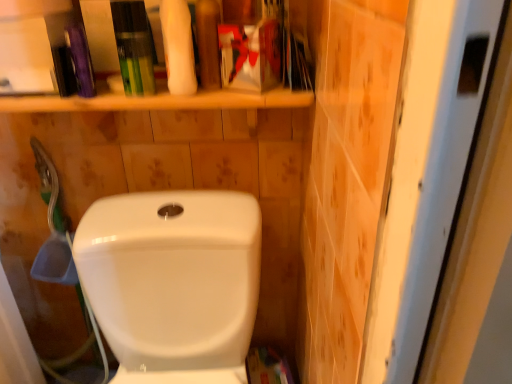
You are a GUI agent. You are given a task and a screenshot of the screen. Output one action in this format:
    pyautogui.click(x=<x>, y=<y>)
    Task: Click on the white glossy toilet at center
    Image resolution: width=512 pixels, height=384 pixels.
    Given the screenshot: What is the action you would take?
    tap(173, 282)

This screenshot has height=384, width=512. Find the location of `matte plastic toothpaste tube at upper center, acting as the 2th toiletry starting from the left`. matte plastic toothpaste tube at upper center, acting as the 2th toiletry starting from the left is located at coordinates (208, 43).

From the picture: Is white matte sponge at upper center to the left or to the right of green plastic tube at upper center, placed as the 2th toiletry when sorted from right to left, in the image?

Based on their positions, white matte sponge at upper center is located to the right of green plastic tube at upper center, placed as the 2th toiletry when sorted from right to left.

From the image's perspective, between white matte sponge at upper center and green plastic tube at upper center, placed as the 2th toiletry when sorted from right to left, which one is located above?

white matte sponge at upper center appears higher in the image.

From the white matte sponge at upper center, count 1st toiletrys backward and point to it. Please provide its 2D coordinates.

[(133, 46)]

Can you confirm if white matte sponge at upper center is shorter than green plastic tube at upper center, placed as the 2th toiletry when sorted from right to left?

No, white matte sponge at upper center is not shorter than green plastic tube at upper center, placed as the 2th toiletry when sorted from right to left.

Is matte plastic toothpaste tube at upper center, arranged as the first toiletry when viewed from the right, inside or outside of white glossy toilet at center?

matte plastic toothpaste tube at upper center, arranged as the first toiletry when viewed from the right, cannot be found inside white glossy toilet at center.

Does matte plastic toothpaste tube at upper center, arranged as the first toiletry when viewed from the right, touch white glossy toilet at center?

No.

This screenshot has width=512, height=384. Identify the location of toilet that appears below the matte plastic toothpaste tube at upper center, arranged as the first toiletry when viewed from the right (from a real-world perspective). (173, 282).

How much distance is there between matte plastic toothpaste tube at upper center, arranged as the first toiletry when viewed from the right, and white glossy toilet at center?

matte plastic toothpaste tube at upper center, arranged as the first toiletry when viewed from the right, and white glossy toilet at center are 15.03 inches apart from each other.

Which of these two, green plastic tube at upper center, placed as the first toiletry when sorted from left to right, or white glossy toilet at center, is bigger?

white glossy toilet at center.

Which is farther, [129,78] or [125,215]?

The point [125,215] is farther from the camera.

Is green plastic tube at upper center, placed as the first toiletry when sorted from left to right, looking in the opposite direction of white glossy toilet at center?

No, green plastic tube at upper center, placed as the first toiletry when sorted from left to right, is not facing away from white glossy toilet at center.

Is white matte sponge at upper center spatially inside matte plastic toothpaste tube at upper center, arranged as the first toiletry when viewed from the right, or outside of it?

white matte sponge at upper center is not inside matte plastic toothpaste tube at upper center, arranged as the first toiletry when viewed from the right, it's outside.

Is white matte sponge at upper center positioned far away from matte plastic toothpaste tube at upper center, arranged as the first toiletry when viewed from the right?

Actually, white matte sponge at upper center and matte plastic toothpaste tube at upper center, arranged as the first toiletry when viewed from the right, are a little close together.

Which of these two, white matte sponge at upper center or matte plastic toothpaste tube at upper center, acting as the 2th toiletry starting from the left, is thinner?

With smaller width is matte plastic toothpaste tube at upper center, acting as the 2th toiletry starting from the left.

Considering the sizes of objects white matte sponge at upper center and matte plastic toothpaste tube at upper center, arranged as the first toiletry when viewed from the right, in the image provided, who is bigger, white matte sponge at upper center or matte plastic toothpaste tube at upper center, arranged as the first toiletry when viewed from the right,?

With larger size is white matte sponge at upper center.

Can you confirm if green plastic tube at upper center, placed as the 2th toiletry when sorted from right to left, is positioned to the right of matte plastic toothpaste tube at upper center, arranged as the first toiletry when viewed from the right?

Incorrect, green plastic tube at upper center, placed as the 2th toiletry when sorted from right to left, is not on the right side of matte plastic toothpaste tube at upper center, arranged as the first toiletry when viewed from the right.

Considering the sizes of objects green plastic tube at upper center, placed as the first toiletry when sorted from left to right, and matte plastic toothpaste tube at upper center, arranged as the first toiletry when viewed from the right, in the image provided, who is taller, green plastic tube at upper center, placed as the first toiletry when sorted from left to right, or matte plastic toothpaste tube at upper center, arranged as the first toiletry when viewed from the right,?

Standing taller between the two is matte plastic toothpaste tube at upper center, arranged as the first toiletry when viewed from the right.

From the image's perspective, is green plastic tube at upper center, placed as the first toiletry when sorted from left to right, on top of matte plastic toothpaste tube at upper center, arranged as the first toiletry when viewed from the right?

Incorrect, from the image's perspective, green plastic tube at upper center, placed as the first toiletry when sorted from left to right, is lower than matte plastic toothpaste tube at upper center, arranged as the first toiletry when viewed from the right.

Measure the distance from green plastic tube at upper center, placed as the 2th toiletry when sorted from right to left, to matte plastic toothpaste tube at upper center, arranged as the first toiletry when viewed from the right.

They are 4.27 inches apart.

Do you think matte plastic toothpaste tube at upper center, acting as the 2th toiletry starting from the left, is within green plastic tube at upper center, placed as the first toiletry when sorted from left to right, or outside of it?

matte plastic toothpaste tube at upper center, acting as the 2th toiletry starting from the left, lies outside green plastic tube at upper center, placed as the first toiletry when sorted from left to right.

Are matte plastic toothpaste tube at upper center, arranged as the first toiletry when viewed from the right, and green plastic tube at upper center, placed as the 2th toiletry when sorted from right to left, located far from each other?

No, there isn't a large distance between matte plastic toothpaste tube at upper center, arranged as the first toiletry when viewed from the right, and green plastic tube at upper center, placed as the 2th toiletry when sorted from right to left.

Does matte plastic toothpaste tube at upper center, acting as the 2th toiletry starting from the left, appear on the left side of green plastic tube at upper center, placed as the first toiletry when sorted from left to right?

In fact, matte plastic toothpaste tube at upper center, acting as the 2th toiletry starting from the left, is to the right of green plastic tube at upper center, placed as the first toiletry when sorted from left to right.

Based on the photo, considering the sizes of objects white glossy toilet at center and matte plastic toothpaste tube at upper center, acting as the 2th toiletry starting from the left, in the image provided, who is bigger, white glossy toilet at center or matte plastic toothpaste tube at upper center, acting as the 2th toiletry starting from the left,?

With larger size is white glossy toilet at center.

From the image's perspective, which object appears higher, white glossy toilet at center or matte plastic toothpaste tube at upper center, acting as the 2th toiletry starting from the left?

matte plastic toothpaste tube at upper center, acting as the 2th toiletry starting from the left, appears higher in the image.

Which is closer to the camera, (123, 264) or (209, 54)?

The point (209, 54) is closer to the camera.

From a real-world perspective, is white glossy toilet at center below matte plastic toothpaste tube at upper center, arranged as the first toiletry when viewed from the right?

Yes, from a real-world perspective, white glossy toilet at center is below matte plastic toothpaste tube at upper center, arranged as the first toiletry when viewed from the right.

At what (x,y) coordinates should I click in order to perform the action: click on cleaning product that is in front of the green plastic tube at upper center, placed as the first toiletry when sorted from left to right. Please return your answer as a coordinate pair (x, y). The width and height of the screenshot is (512, 384). Looking at the image, I should click on (178, 47).

You are a GUI agent. You are given a task and a screenshot of the screen. Output one action in this format:
    pyautogui.click(x=<x>, y=<y>)
    Task: Click on the toiletry on the right of white glossy toilet at center
    
    Given the screenshot: What is the action you would take?
    pyautogui.click(x=208, y=43)

From the image, which object appears to be nearer to white glossy toilet at center, white matte sponge at upper center or green plastic tube at upper center, placed as the first toiletry when sorted from left to right?

green plastic tube at upper center, placed as the first toiletry when sorted from left to right, lies closer to white glossy toilet at center than the other object.

From the image, which object appears to be farther from white matte sponge at upper center, green plastic tube at upper center, placed as the first toiletry when sorted from left to right, or matte plastic toothpaste tube at upper center, arranged as the first toiletry when viewed from the right?

green plastic tube at upper center, placed as the first toiletry when sorted from left to right, is further to white matte sponge at upper center.

From the image, which object appears to be farther from green plastic tube at upper center, placed as the first toiletry when sorted from left to right, matte plastic toothpaste tube at upper center, arranged as the first toiletry when viewed from the right, or white matte sponge at upper center?

matte plastic toothpaste tube at upper center, arranged as the first toiletry when viewed from the right.

Considering their positions, is matte plastic toothpaste tube at upper center, acting as the 2th toiletry starting from the left, positioned closer to white glossy toilet at center than green plastic tube at upper center, placed as the first toiletry when sorted from left to right?

green plastic tube at upper center, placed as the first toiletry when sorted from left to right.

From the image, which object appears to be nearer to green plastic tube at upper center, placed as the first toiletry when sorted from left to right, matte plastic toothpaste tube at upper center, arranged as the first toiletry when viewed from the right, or white glossy toilet at center?

Based on the image, matte plastic toothpaste tube at upper center, arranged as the first toiletry when viewed from the right, appears to be nearer to green plastic tube at upper center, placed as the first toiletry when sorted from left to right.

Considering their positions, is white glossy toilet at center positioned closer to green plastic tube at upper center, placed as the 2th toiletry when sorted from right to left, than white matte sponge at upper center?

The object closer to green plastic tube at upper center, placed as the 2th toiletry when sorted from right to left, is white matte sponge at upper center.

Considering their positions, is green plastic tube at upper center, placed as the 2th toiletry when sorted from right to left, positioned further to matte plastic toothpaste tube at upper center, arranged as the first toiletry when viewed from the right, than white glossy toilet at center?

white glossy toilet at center lies further to matte plastic toothpaste tube at upper center, arranged as the first toiletry when viewed from the right, than the other object.

When comparing their distances from white glossy toilet at center, does green plastic tube at upper center, placed as the 2th toiletry when sorted from right to left, or matte plastic toothpaste tube at upper center, arranged as the first toiletry when viewed from the right, seem further?

Among the two, matte plastic toothpaste tube at upper center, arranged as the first toiletry when viewed from the right, is located further to white glossy toilet at center.

You are a GUI agent. You are given a task and a screenshot of the screen. Output one action in this format:
    pyautogui.click(x=<x>, y=<y>)
    Task: Click on the cleaning product located between green plastic tube at upper center, placed as the 2th toiletry when sorted from right to left, and matte plastic toothpaste tube at upper center, arranged as the first toiletry when viewed from the right, in the left-right direction
    This screenshot has height=384, width=512.
    Given the screenshot: What is the action you would take?
    pyautogui.click(x=178, y=47)

This screenshot has width=512, height=384. In order to click on toiletry between matte plastic toothpaste tube at upper center, arranged as the first toiletry when viewed from the right, and white glossy toilet at center, in the vertical direction in this screenshot , I will do `click(133, 46)`.

Find the location of a particular element. This screenshot has width=512, height=384. cleaning product between matte plastic toothpaste tube at upper center, acting as the 2th toiletry starting from the left, and white glossy toilet at center, in the vertical direction is located at coordinates (178, 47).

This screenshot has height=384, width=512. I want to click on toiletry between white matte sponge at upper center and white glossy toilet at center in the up-down direction, so click(x=133, y=46).